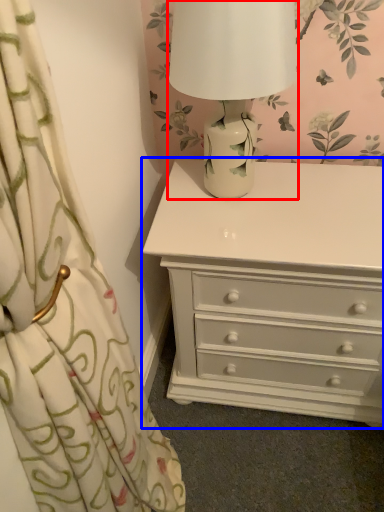
Question: Among these objects, which one is nearest to the camera, table lamp (highlighted by a red box) or chest of drawers (highlighted by a blue box)?

Choices:
 (A) table lamp
 (B) chest of drawers

Answer: (A)